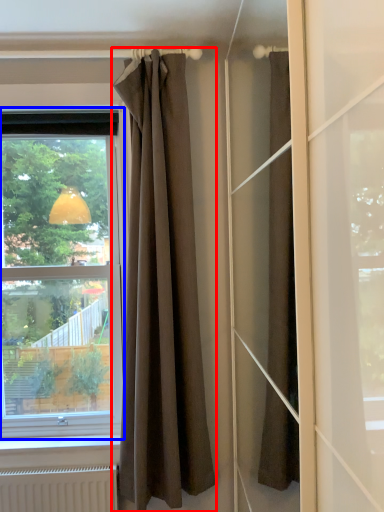
Question: Among these objects, which one is farthest to the camera, curtain (highlighted by a red box) or window (highlighted by a blue box)?

Choices:
 (A) curtain
 (B) window

Answer: (B)